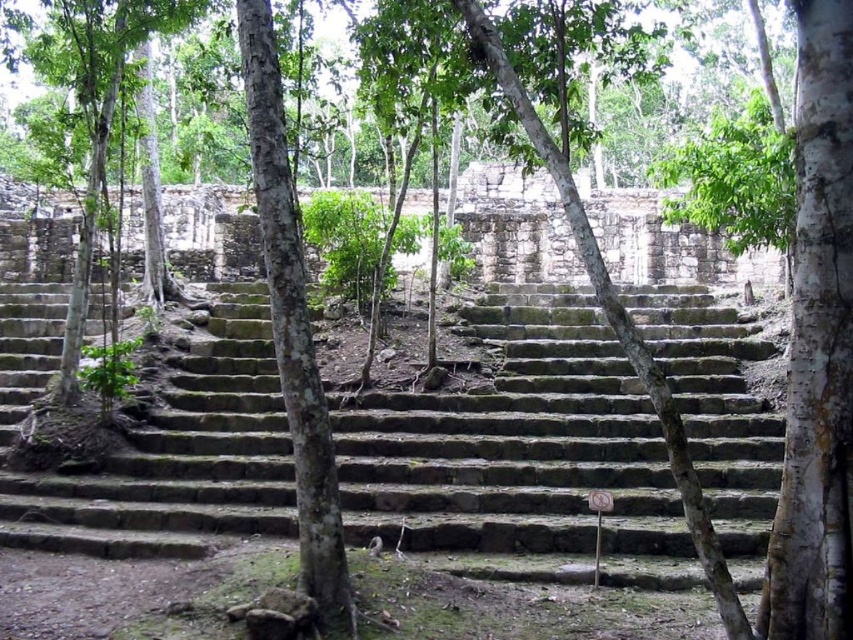
Between green mossy stone stairs at center and white textured bark at right, which one has more height?

Standing taller between the two is white textured bark at right.

Describe the element at coordinates (521, 458) in the screenshot. I see `green mossy stone stairs at center` at that location.

The image size is (853, 640). Find the location of `green mossy stone stairs at center`. green mossy stone stairs at center is located at coordinates (521, 458).

Who is more distant from viewer, (x=395, y=468) or (x=288, y=200)?

Positioned behind is point (x=395, y=468).

Looking at this image, does green mossy stone stairs at center lie behind green rough bark tree at center?

Yes, green mossy stone stairs at center is further from the viewer.

What do you see at coordinates (521, 458) in the screenshot?
I see `green mossy stone stairs at center` at bounding box center [521, 458].

Identify the location of green mossy stone stairs at center. (521, 458).

Does white textured bark at right appear over green rough bark tree at center?

Yes.

Which is below, white textured bark at right or green rough bark tree at center?

green rough bark tree at center is below.

Where is `white textured bark at right`? Image resolution: width=853 pixels, height=640 pixels. white textured bark at right is located at coordinates (817, 348).

In order to click on white textured bark at right in this screenshot , I will do `click(817, 348)`.